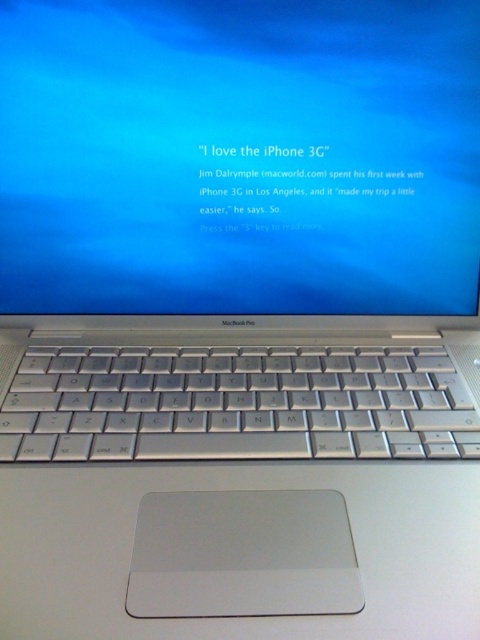
Is satin silver screen at center to the left of silver metallic keyboard at center from the viewer's perspective?

No, satin silver screen at center is not to the left of silver metallic keyboard at center.

Is point (364, 273) positioned before point (446, 364)?

No.

What do you see at coordinates (240, 156) in the screenshot? This screenshot has width=480, height=640. I see `satin silver screen at center` at bounding box center [240, 156].

Where is `satin silver screen at center`? Image resolution: width=480 pixels, height=640 pixels. satin silver screen at center is located at coordinates (240, 156).